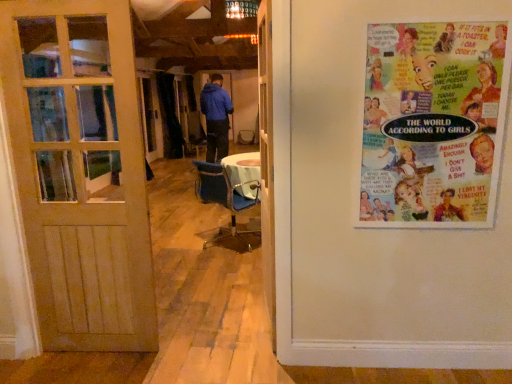
Describe the element at coordinates (225, 200) in the screenshot. I see `blue fabric chair at center` at that location.

Locate an element on the screen. This screenshot has height=384, width=512. blue fabric chair at center is located at coordinates (225, 200).

Is white wooden door at center, acting as the 2th door starting from the left, to the left or to the right of colorful paper poster at upper right in the image?

white wooden door at center, acting as the 2th door starting from the left, is positioned on colorful paper poster at upper right's left side.

This screenshot has height=384, width=512. Identify the location of poster above the white wooden door at center, the first door from the right (from the image's perspective). (433, 123).

From the image's perspective, between white wooden door at center, acting as the 2th door starting from the left, and colorful paper poster at upper right, which one is located above?

From the image's view, colorful paper poster at upper right is above.

Is white wooden door at center, acting as the 2th door starting from the left, completely or partially inside colorful paper poster at upper right?

No.

Is colorful paper poster at upper right facing away from white wooden door at center, acting as the 2th door starting from the left?

colorful paper poster at upper right does not have its back to white wooden door at center, acting as the 2th door starting from the left.

Which is in front, point (385, 207) or point (269, 256)?

Positioned in front is point (385, 207).

Visually, is colorful paper poster at upper right positioned to the left or to the right of white wooden door at center, the first door from the right?

colorful paper poster at upper right is to the right of white wooden door at center, the first door from the right.

From the image's perspective, between blue fabric chair at center and white wooden door at center, the first door from the right, who is located below?

blue fabric chair at center, from the image's perspective.

Is blue fabric chair at center surrounding white wooden door at center, the first door from the right?

That's incorrect, white wooden door at center, the first door from the right, is not inside blue fabric chair at center.

Between blue fabric chair at center and white wooden door at center, the first door from the right, which one has smaller width?

Thinner between the two is white wooden door at center, the first door from the right.

Can you tell me how much blue fabric chair at center and white wooden door at center, the first door from the right, differ in facing direction?

blue fabric chair at center and white wooden door at center, the first door from the right, are facing 137 degrees away from each other.

Is colorful paper poster at upper right placed right next to blue fabric chair at center?

There is a gap between colorful paper poster at upper right and blue fabric chair at center.

Based on the photo, between colorful paper poster at upper right and blue fabric chair at center, which one appears on the right side from the viewer's perspective?

From the viewer's perspective, colorful paper poster at upper right appears more on the right side.

From the picture: Is colorful paper poster at upper right situated inside blue fabric chair at center or outside?

colorful paper poster at upper right cannot be found inside blue fabric chair at center.

Can you confirm if colorful paper poster at upper right is smaller than blue fabric chair at center?

Yes.

Does point (272, 257) come closer to viewer compared to point (119, 285)?

No, it is not.

The width and height of the screenshot is (512, 384). I want to click on door above the wooden door at left, which is the 1th door in left-to-right order (from a real-world perspective), so click(x=267, y=157).

Is white wooden door at center, acting as the 2th door starting from the left, to the right of wooden door at left, which is the 1th door in left-to-right order, from the viewer's perspective?

Yes.

How many degrees apart are the facing directions of white wooden door at center, acting as the 2th door starting from the left, and wooden door at left, placed as the second door when sorted from right to left?

The angular difference between white wooden door at center, acting as the 2th door starting from the left, and wooden door at left, placed as the second door when sorted from right to left, is 81.5 degrees.

Which door is the 1st one when counting from the front of the blue fabric chair at center? Please provide its 2D coordinates.

[(80, 171)]

From the image's perspective, which one is positioned higher, wooden door at left, which is the 1th door in left-to-right order, or blue fabric chair at center?

wooden door at left, which is the 1th door in left-to-right order, appears higher in the image.

Considering the points (129, 167) and (204, 172), which point is in front, point (129, 167) or point (204, 172)?

The point (129, 167) is more forward.

Which of these two, blue fabric chair at center or colorful paper poster at upper right, is wider?

blue fabric chair at center is wider.

Considering the positions of points (233, 233) and (389, 131), is point (233, 233) closer to camera compared to point (389, 131)?

No, it is not.

Would you say colorful paper poster at upper right is part of blue fabric chair at center's contents?

That's incorrect, colorful paper poster at upper right is not inside blue fabric chair at center.

Image resolution: width=512 pixels, height=384 pixels. Identify the location of door that is the 1st object located below the colorful paper poster at upper right (from the image's perspective). (267, 157).

In order to click on the 1st door behind when counting from the colorful paper poster at upper right in this screenshot , I will do `click(267, 157)`.

From the image, which object appears to be farther from wooden door at left, which is the 1th door in left-to-right order, white wooden door at center, acting as the 2th door starting from the left, or blue fabric chair at center?

blue fabric chair at center lies further to wooden door at left, which is the 1th door in left-to-right order, than the other object.

Based on the photo, from the image, which object appears to be nearer to white wooden door at center, acting as the 2th door starting from the left, wooden door at left, which is the 1th door in left-to-right order, or blue fabric chair at center?

wooden door at left, which is the 1th door in left-to-right order, is positioned closer to the anchor white wooden door at center, acting as the 2th door starting from the left.

When comparing their distances from blue fabric chair at center, does colorful paper poster at upper right or wooden door at left, placed as the second door when sorted from right to left, seem further?

Based on the image, colorful paper poster at upper right appears to be further to blue fabric chair at center.

When comparing their distances from colorful paper poster at upper right, does blue fabric chair at center or white wooden door at center, the first door from the right, seem closer?

white wooden door at center, the first door from the right.

When comparing their distances from white wooden door at center, the first door from the right, does wooden door at left, placed as the second door when sorted from right to left, or colorful paper poster at upper right seem further?

The object further to white wooden door at center, the first door from the right, is wooden door at left, placed as the second door when sorted from right to left.

Estimate the real-world distances between objects in this image. Which object is closer to wooden door at left, which is the 1th door in left-to-right order, colorful paper poster at upper right or white wooden door at center, the first door from the right?

white wooden door at center, the first door from the right.

Based on their spatial positions, is white wooden door at center, acting as the 2th door starting from the left, or wooden door at left, placed as the second door when sorted from right to left, closer to colorful paper poster at upper right?

white wooden door at center, acting as the 2th door starting from the left.

Estimate the real-world distances between objects in this image. Which object is closer to white wooden door at center, acting as the 2th door starting from the left, blue fabric chair at center or colorful paper poster at upper right?

Among the two, colorful paper poster at upper right is located nearer to white wooden door at center, acting as the 2th door starting from the left.

At what (x,y) coordinates should I click in order to perform the action: click on door between white wooden door at center, the first door from the right, and blue fabric chair at center from front to back. Please return your answer as a coordinate pair (x, y). Looking at the image, I should click on (80, 171).

The height and width of the screenshot is (384, 512). I want to click on door located between wooden door at left, placed as the second door when sorted from right to left, and colorful paper poster at upper right in the left-right direction, so click(267, 157).